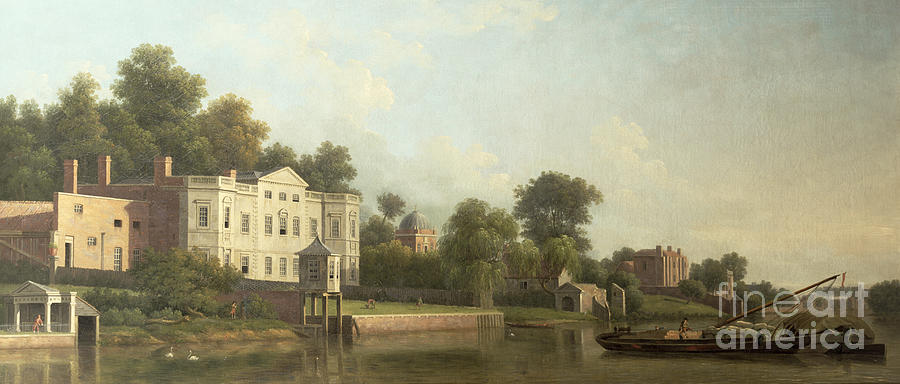
Find the location of a particular element. The height and width of the screenshot is (384, 900). chimney is located at coordinates (x=65, y=177), (x=104, y=174), (x=168, y=165).